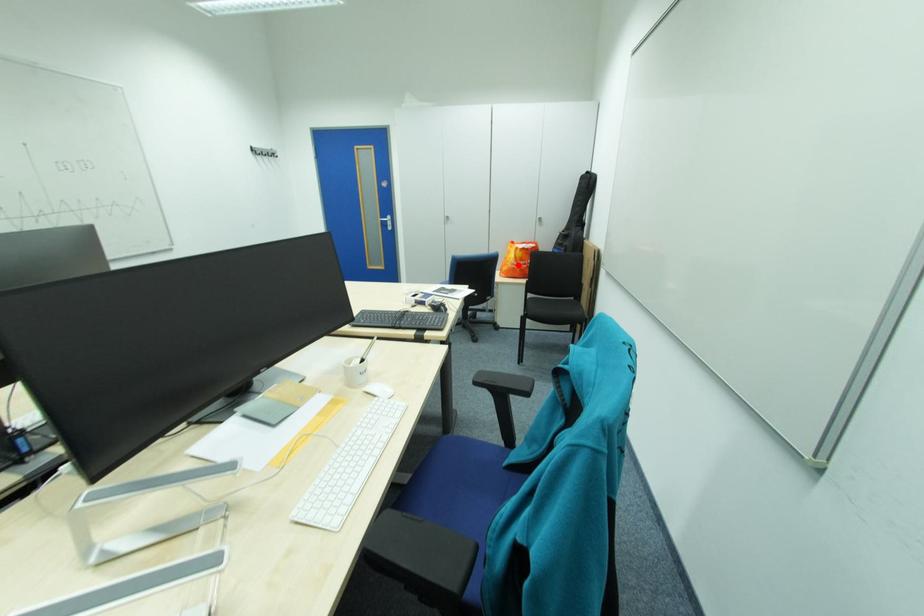
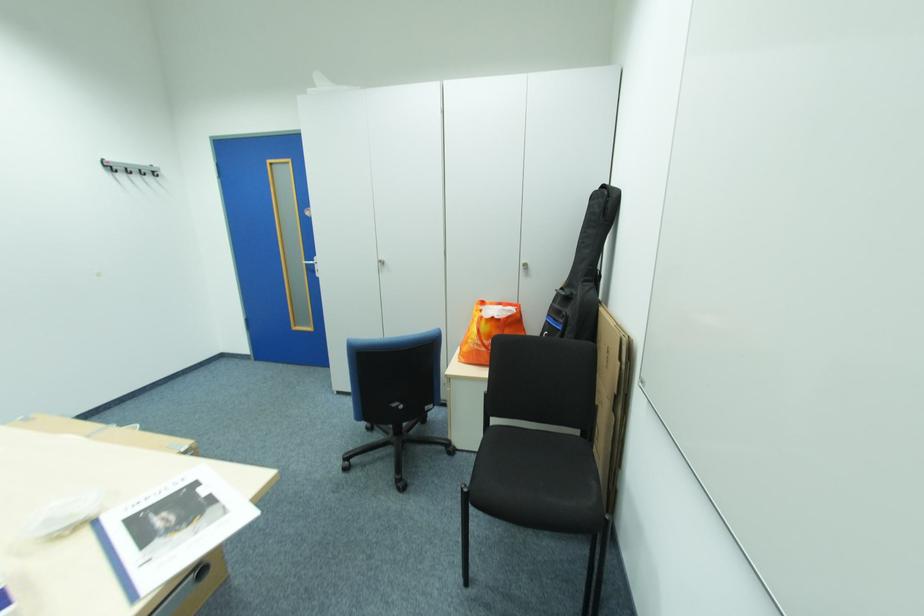
Question: I am providing you with two images of the same scene from different viewpoints. A red point is shown in image1. For the corresponding object point in image2, is it positioned nearer or farther from the camera?

Choices:
 (A) Nearer
 (B) Farther

Answer: (B)